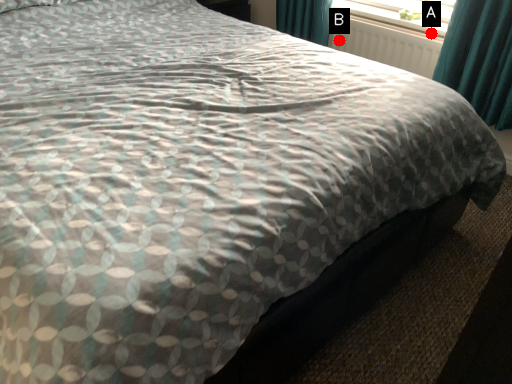
Question: Two points are circled on the image, labeled by A and B beside each circle. Which point is farther to the camera?

Choices:
 (A) A is further
 (B) B is further

Answer: (B)